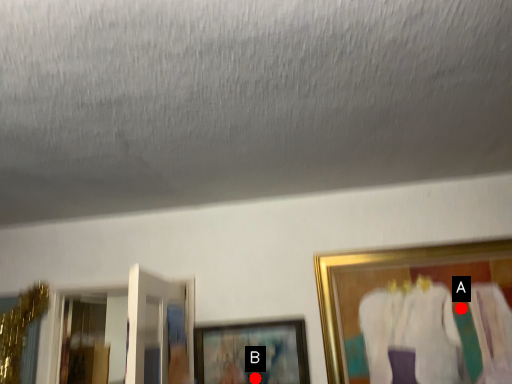
Question: Two points are circled on the image, labeled by A and B beside each circle. Which point is closer to the camera?

Choices:
 (A) A is closer
 (B) B is closer

Answer: (A)